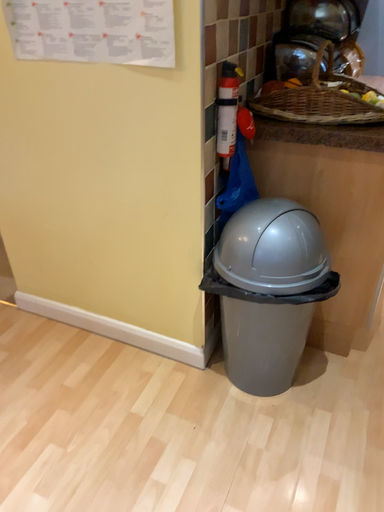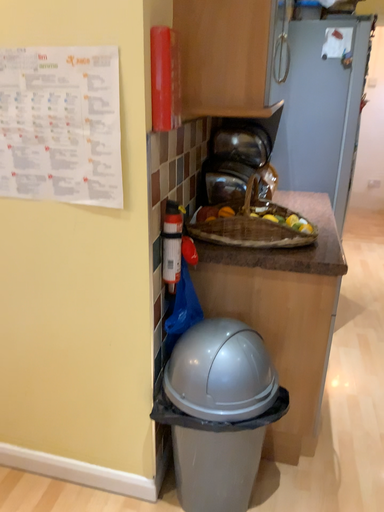
Question: Which way did the camera rotate in the video?

Choices:
 (A) rotated upward
 (B) rotated downward

Answer: (A)